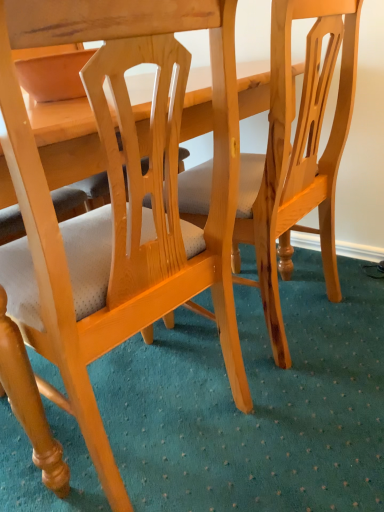
Find the location of a particular element. Image resolution: width=384 pixels, height=512 pixels. vacant space to the right of light brown wood chair at center, which ranks as the 2th chair in right-to-left order is located at coordinates (312, 412).